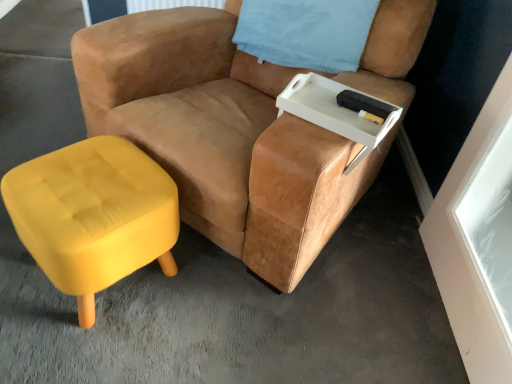
Question: Considering the relative sizes of blue fabric pillow at upper right and white plastic tray at upper right in the image provided, is blue fabric pillow at upper right wider than white plastic tray at upper right?

Choices:
 (A) yes
 (B) no

Answer: (A)

Question: Are blue fabric pillow at upper right and white plastic tray at upper right far apart?

Choices:
 (A) no
 (B) yes

Answer: (A)

Question: From a real-world perspective, is blue fabric pillow at upper right below white plastic tray at upper right?

Choices:
 (A) no
 (B) yes

Answer: (A)

Question: Is blue fabric pillow at upper right touching white plastic tray at upper right?

Choices:
 (A) yes
 (B) no

Answer: (B)

Question: Can you confirm if blue fabric pillow at upper right is thinner than white plastic tray at upper right?

Choices:
 (A) no
 (B) yes

Answer: (A)

Question: Relative to suede tan chair at center, is white plastic tray at upper right in front or behind?

Choices:
 (A) front
 (B) behind

Answer: (B)

Question: From their relative heights in the image, would you say white plastic tray at upper right is taller or shorter than suede tan chair at center?

Choices:
 (A) tall
 (B) short

Answer: (B)

Question: From the image's perspective, is white plastic tray at upper right positioned above or below suede tan chair at center?

Choices:
 (A) below
 (B) above

Answer: (A)

Question: In terms of width, does white plastic tray at upper right look wider or thinner when compared to suede tan chair at center?

Choices:
 (A) wide
 (B) thin

Answer: (B)

Question: Looking at their shapes, would you say velvet yellow ottoman at lower left is wider or thinner than white plastic tray at upper right?

Choices:
 (A) thin
 (B) wide

Answer: (B)

Question: Is point click(136, 243) closer or farther from the camera than point click(315, 92)?

Choices:
 (A) farther
 (B) closer

Answer: (B)

Question: Do you think velvet yellow ottoman at lower left is within white plastic tray at upper right, or outside of it?

Choices:
 (A) outside
 (B) inside

Answer: (A)

Question: Visually, is velvet yellow ottoman at lower left positioned to the left or to the right of white plastic tray at upper right?

Choices:
 (A) left
 (B) right

Answer: (A)

Question: Is velvet yellow ottoman at lower left inside the boundaries of blue fabric pillow at upper right, or outside?

Choices:
 (A) outside
 (B) inside

Answer: (A)

Question: Is point (87, 322) positioned closer to the camera than point (361, 1)?

Choices:
 (A) farther
 (B) closer

Answer: (B)